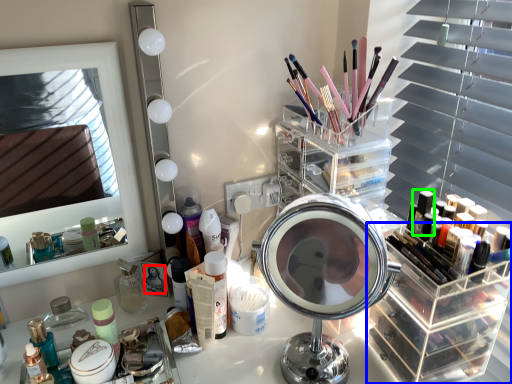
Question: Which object is the closest to the makeup artist (highlighted by a red box)? Choose among these: shelf (highlighted by a blue box) or toiletry (highlighted by a green box).

Choices:
 (A) shelf
 (B) toiletry

Answer: (A)